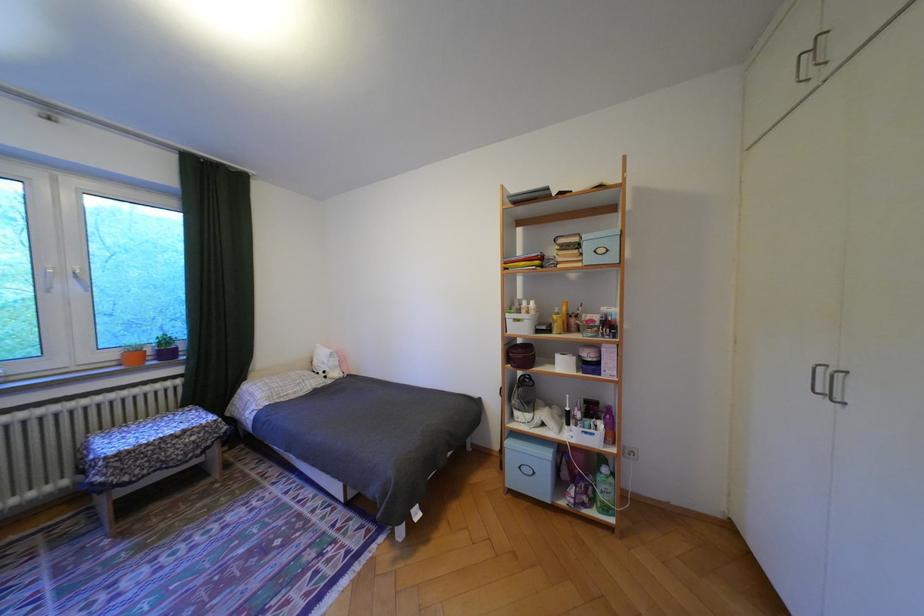
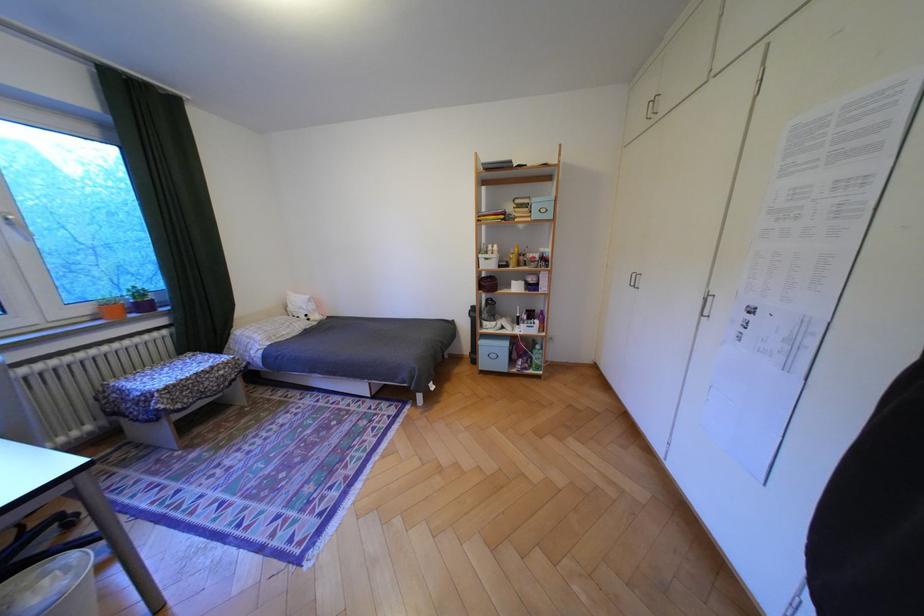
The point at (603, 408) is marked in the first image. Where is the corresponding point in the second image?

(542, 315)